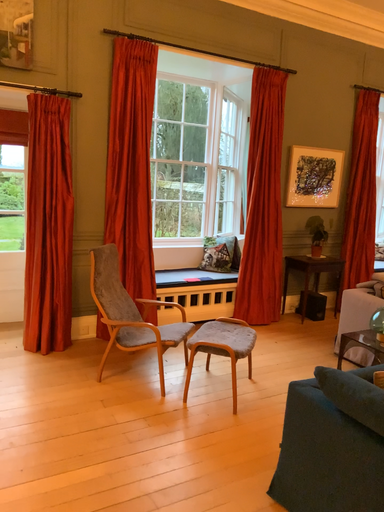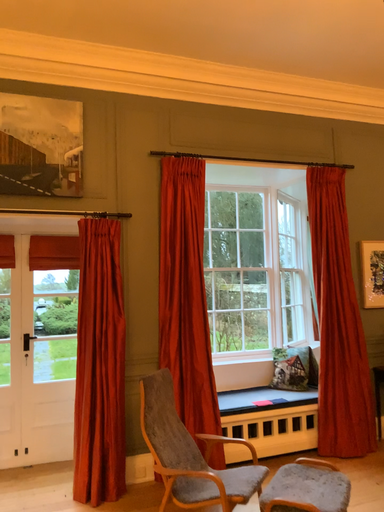
Question: How did the camera likely rotate when shooting the video?

Choices:
 (A) rotated upward
 (B) rotated downward

Answer: (A)